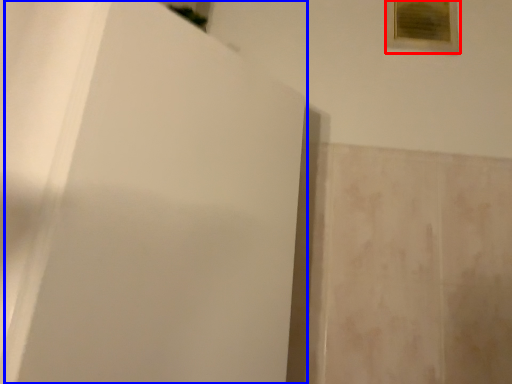
Question: Which object appears closest to the camera in this image, picture frame (highlighted by a red box) or screen door (highlighted by a blue box)?

Choices:
 (A) picture frame
 (B) screen door

Answer: (B)